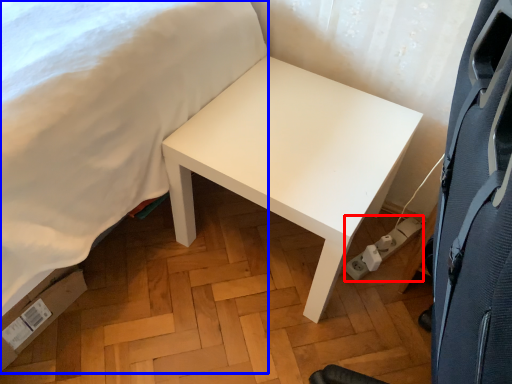
Question: Which object is closer to the camera taking this photo, electric outlet (highlighted by a red box) or bed (highlighted by a blue box)?

Choices:
 (A) electric outlet
 (B) bed

Answer: (B)